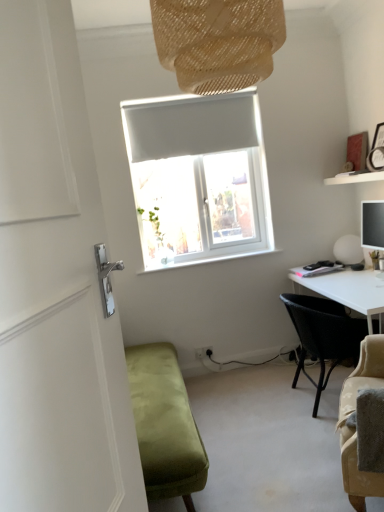
Question: Does velvet green bench at lower left appear on the right side of white matte shelf at upper right?

Choices:
 (A) no
 (B) yes

Answer: (A)

Question: Is velvet green bench at lower left facing away from white matte shelf at upper right?

Choices:
 (A) yes
 (B) no

Answer: (B)

Question: Is velvet green bench at lower left bigger than white matte shelf at upper right?

Choices:
 (A) no
 (B) yes

Answer: (B)

Question: From a real-world perspective, is velvet green bench at lower left positioned over white matte shelf at upper right based on gravity?

Choices:
 (A) no
 (B) yes

Answer: (A)

Question: Is velvet green bench at lower left outside of white matte shelf at upper right?

Choices:
 (A) yes
 (B) no

Answer: (A)

Question: From the image's perspective, is velvet green bench at lower left above white matte shelf at upper right?

Choices:
 (A) yes
 (B) no

Answer: (B)

Question: From a real-world perspective, does velvet green bench at lower left sit lower than white matte sphere at right?

Choices:
 (A) yes
 (B) no

Answer: (A)

Question: From the image's perspective, is velvet green bench at lower left located beneath white matte sphere at right?

Choices:
 (A) yes
 (B) no

Answer: (A)

Question: Does velvet green bench at lower left have a greater height compared to white matte sphere at right?

Choices:
 (A) no
 (B) yes

Answer: (B)

Question: Is velvet green bench at lower left further to the viewer compared to white matte sphere at right?

Choices:
 (A) no
 (B) yes

Answer: (A)

Question: Is velvet green bench at lower left wider than white matte sphere at right?

Choices:
 (A) no
 (B) yes

Answer: (B)

Question: Is velvet green bench at lower left to the right of white matte sphere at right from the viewer's perspective?

Choices:
 (A) no
 (B) yes

Answer: (A)

Question: Does white matte shelf at upper right turn towards white matte sphere at right?

Choices:
 (A) no
 (B) yes

Answer: (A)